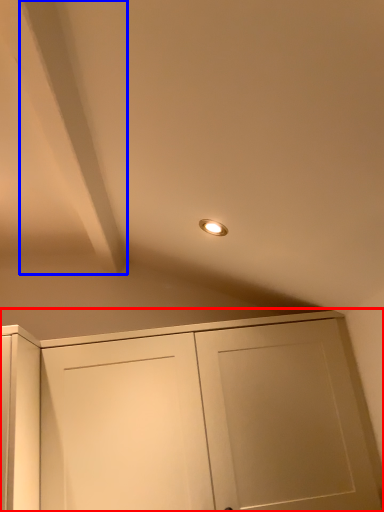
Question: Among these objects, which one is nearest to the camera, cupboard (highlighted by a red box) or exhaust hood (highlighted by a blue box)?

Choices:
 (A) cupboard
 (B) exhaust hood

Answer: (B)